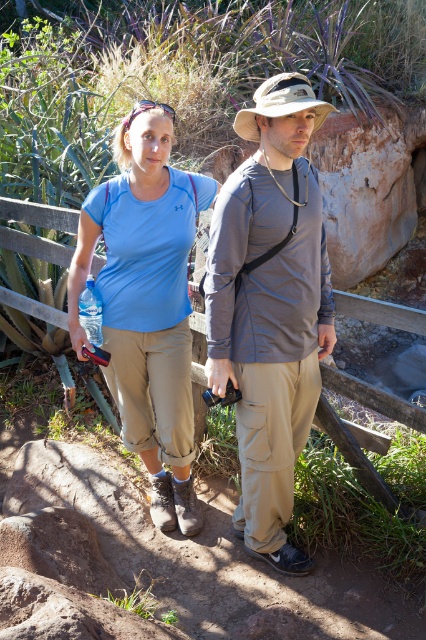
You are a photographer trying to capture a photo of the two hikers. You want to ensure that the matte blue shirt at center is clearly visible in the frame. Where should you position your camera relative to the point at coordinates (270, 307)?

The point at coordinates (270, 307) is where the matte blue shirt at center is located. To ensure it is clearly visible, position the camera directly facing this point.

You are a photographer trying to capture a candid shot of two hikers. The two objects in focus are the matte blue shirt at center and the tan fabric hat at center. If your camera has a depth of field that can sharply focus on objects within a 30 inch range, will both objects be in focus at the same time?

The matte blue shirt at center and tan fabric hat at center are 34.69 inches apart from each other. Since the distance between them exceeds the 30 inch range of the camera, they cannot both be in focus simultaneously.